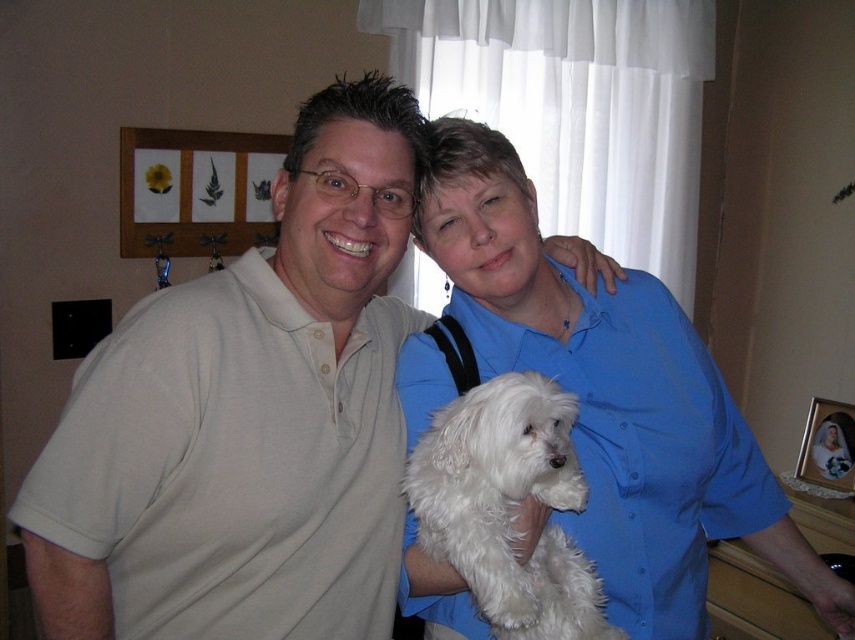
Question: Which of the following is the closest to the observer?

Choices:
 (A) matte beige polo shirt at left
 (B) blue smooth shirt at center
 (C) white fluffy dog at center
 (D) blue satin blouse at upper center

Answer: (A)

Question: Based on their relative distances, which object is nearer to the white fluffy dog at center?

Choices:
 (A) matte beige polo shirt at left
 (B) blue satin blouse at upper center
 (C) blue smooth shirt at center

Answer: (C)

Question: From the image, what is the correct spatial relationship of white fluffy dog at center in relation to blue satin blouse at upper center?

Choices:
 (A) above
 (B) below

Answer: (A)

Question: Can you confirm if matte beige polo shirt at left is wider than white fluffy dog at center?

Choices:
 (A) no
 (B) yes

Answer: (B)

Question: Is matte beige polo shirt at left smaller than white fluffy dog at center?

Choices:
 (A) no
 (B) yes

Answer: (A)

Question: Estimate the real-world distances between objects in this image. Which object is farther from the blue smooth shirt at center?

Choices:
 (A) white fluffy dog at center
 (B) matte beige polo shirt at left

Answer: (B)